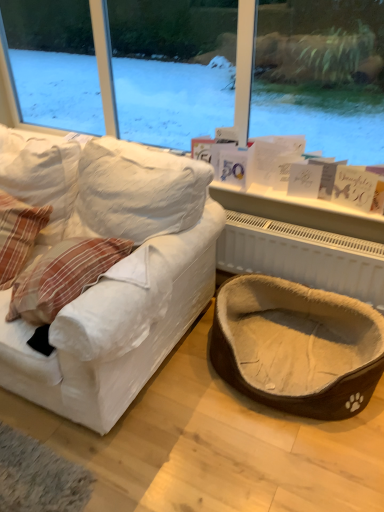
This screenshot has width=384, height=512. What do you see at coordinates (117, 292) in the screenshot?
I see `white fabric couch at left` at bounding box center [117, 292].

The height and width of the screenshot is (512, 384). What do you see at coordinates (18, 234) in the screenshot?
I see `plaid fabric pillow at left` at bounding box center [18, 234].

Locate an element on the screen. Image resolution: width=384 pixels, height=512 pixels. plaid fabric pillow at left is located at coordinates (18, 234).

I want to click on white fabric couch at left, so click(117, 292).

From the image's perspective, between white textured radiator at lower right and plaid fabric pillow at left, which one is located above?

plaid fabric pillow at left.

Looking at this image, is white textured radiator at lower right inside the boundaries of plaid fabric pillow at left, or outside?

The correct answer is: outside.

Is white textured radiator at lower right beside plaid fabric pillow at left?

No, white textured radiator at lower right is not in contact with plaid fabric pillow at left.

Is white textured radiator at lower right aimed at plaid fabric pillow at left?

No, white textured radiator at lower right is not facing towards plaid fabric pillow at left.

Considering the sizes of objects plaid fabric pillow at left and brown fuzzy pet bed at lower right in the image provided, who is thinner, plaid fabric pillow at left or brown fuzzy pet bed at lower right?

Thinner between the two is plaid fabric pillow at left.

Between plaid fabric pillow at left and brown fuzzy pet bed at lower right, which one is positioned behind?

plaid fabric pillow at left is further from the camera.

From the image's perspective, between plaid fabric pillow at left and brown fuzzy pet bed at lower right, which one is located above?

→ plaid fabric pillow at left appears higher in the image.

Is plaid fabric pillow at left oriented away from brown fuzzy pet bed at lower right?

No.

Is plaid fabric pillow at left next to white textured radiator at lower right?

No.

Which of these two, plaid fabric pillow at left or white textured radiator at lower right, is wider?

With larger width is plaid fabric pillow at left.

I want to click on radiator directly beneath the plaid fabric pillow at left (from a real-world perspective), so click(303, 256).

From the picture: Which is in front, brown fuzzy pet bed at lower right or plaid fabric pillow at left?

brown fuzzy pet bed at lower right is more forward.

Which object is thinner, brown fuzzy pet bed at lower right or plaid fabric pillow at left?

Thinner between the two is plaid fabric pillow at left.

Considering the relative sizes of brown fuzzy pet bed at lower right and plaid fabric pillow at left in the image provided, is brown fuzzy pet bed at lower right smaller than plaid fabric pillow at left?

Actually, brown fuzzy pet bed at lower right might be larger than plaid fabric pillow at left.

Considering the sizes of brown fuzzy pet bed at lower right and plaid fabric pillow at left in the image, is brown fuzzy pet bed at lower right taller or shorter than plaid fabric pillow at left?

brown fuzzy pet bed at lower right is shorter than plaid fabric pillow at left.

From a real-world perspective, is white textured radiator at lower right positioned above or below brown fuzzy pet bed at lower right?

In terms of real-world spatial position, white textured radiator at lower right is above brown fuzzy pet bed at lower right.

Does point (296, 237) come closer to viewer compared to point (300, 402)?

No, it is behind (300, 402).

From the image's perspective, which is above, white textured radiator at lower right or brown fuzzy pet bed at lower right?

white textured radiator at lower right, from the image's perspective.

What's the angular difference between white textured radiator at lower right and brown fuzzy pet bed at lower right's facing directions?

1.07 degrees separate the facing orientations of white textured radiator at lower right and brown fuzzy pet bed at lower right.

Is white textured radiator at lower right positioned with its back to white fabric couch at left?

No, white textured radiator at lower right's orientation is not away from white fabric couch at left.

Is white textured radiator at lower right directly adjacent to white fabric couch at left?

No, white textured radiator at lower right is not beside white fabric couch at left.

Can you confirm if white textured radiator at lower right is wider than white fabric couch at left?

No, white textured radiator at lower right is not wider than white fabric couch at left.

Is point (307, 251) closer or farther from the camera than point (166, 215)?

Point (307, 251) is farther from the camera than point (166, 215).

Is brown fuzzy pet bed at lower right in contact with white textured radiator at lower right?

No, brown fuzzy pet bed at lower right is not beside white textured radiator at lower right.

From a real-world perspective, is brown fuzzy pet bed at lower right located higher than white textured radiator at lower right?

Actually, brown fuzzy pet bed at lower right is physically below white textured radiator at lower right in the real world.

In order to click on radiator behind the plaid fabric pillow at left in this screenshot , I will do `click(303, 256)`.

Image resolution: width=384 pixels, height=512 pixels. I want to click on dog bed that appears on the right of plaid fabric pillow at left, so click(297, 346).

Considering their positions, is brown fuzzy pet bed at lower right positioned further to plaid fabric pillow at left than white textured radiator at lower right?

brown fuzzy pet bed at lower right is further to plaid fabric pillow at left.

Based on their spatial positions, is brown fuzzy pet bed at lower right or plaid fabric pillow at left further from white fabric couch at left?

brown fuzzy pet bed at lower right lies further to white fabric couch at left than the other object.

Considering their positions, is white textured radiator at lower right positioned closer to plaid fabric pillow at left than brown fuzzy pet bed at lower right?

Among the two, white textured radiator at lower right is located nearer to plaid fabric pillow at left.

In the scene shown: From the image, which object appears to be nearer to white textured radiator at lower right, plaid fabric pillow at left or white fabric couch at left?

white fabric couch at left is positioned closer to the anchor white textured radiator at lower right.

From the image, which object appears to be nearer to white textured radiator at lower right, white fabric couch at left or plaid fabric pillow at left?

Among the two, white fabric couch at left is located nearer to white textured radiator at lower right.

From the image, which object appears to be farther from white fabric couch at left, white textured radiator at lower right or plaid fabric pillow at left?

white textured radiator at lower right is positioned further to the anchor white fabric couch at left.

Looking at the image, which one is located further to white fabric couch at left, white textured radiator at lower right or brown fuzzy pet bed at lower right?

white textured radiator at lower right.

Considering their positions, is white fabric couch at left positioned closer to white textured radiator at lower right than brown fuzzy pet bed at lower right?

The object closer to white textured radiator at lower right is brown fuzzy pet bed at lower right.

Where is `dog bed between white fabric couch at left and white textured radiator at lower right`? dog bed between white fabric couch at left and white textured radiator at lower right is located at coordinates (297, 346).

Find the location of a particular element. The image size is (384, 512). dog bed situated between plaid fabric pillow at left and white textured radiator at lower right from left to right is located at coordinates (297, 346).

The height and width of the screenshot is (512, 384). Identify the location of studio couch between plaid fabric pillow at left and brown fuzzy pet bed at lower right in the horizontal direction. (117, 292).

Locate an element on the screen. studio couch situated between plaid fabric pillow at left and white textured radiator at lower right from left to right is located at coordinates (117, 292).